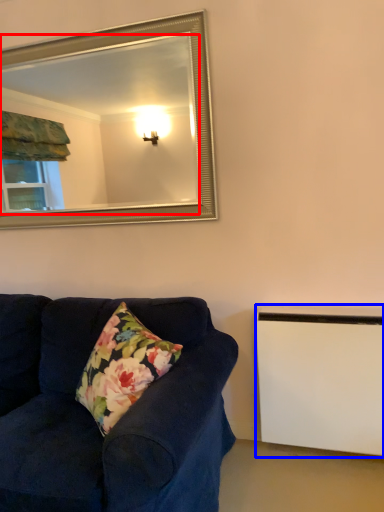
Question: Which object is closer to the camera taking this photo, mirror (highlighted by a red box) or radiator (highlighted by a blue box)?

Choices:
 (A) mirror
 (B) radiator

Answer: (B)